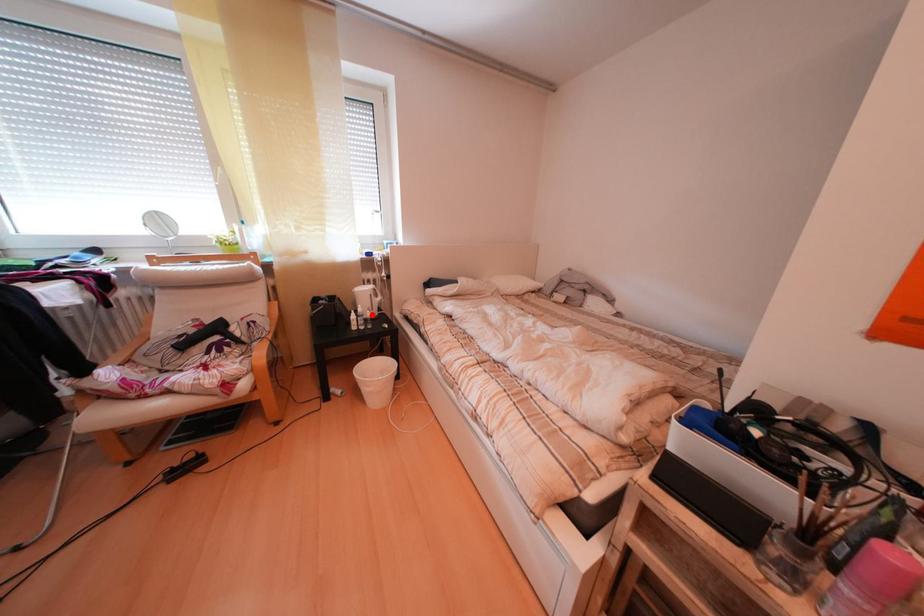
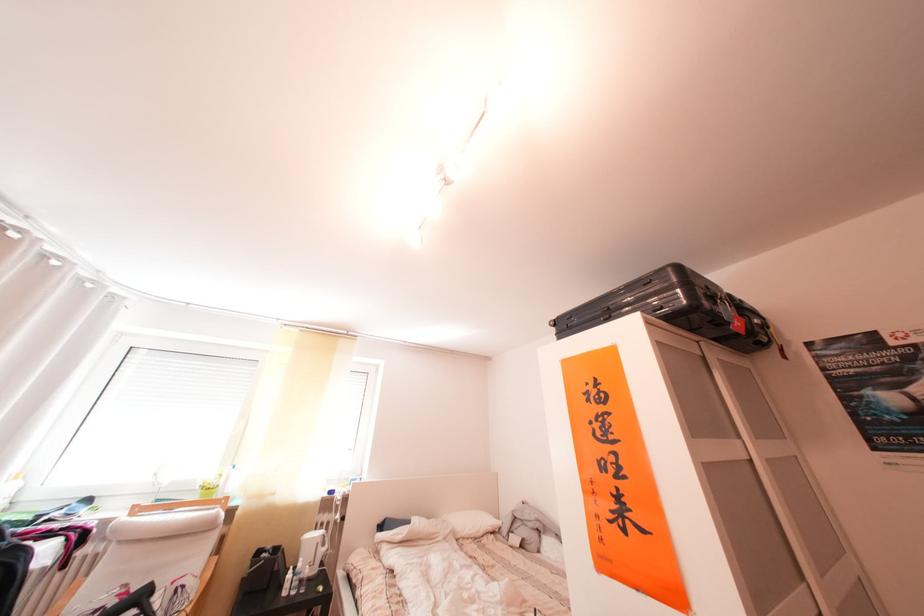
Find the pixel in the second image that matches the highlighted location in the first image.

(312, 570)